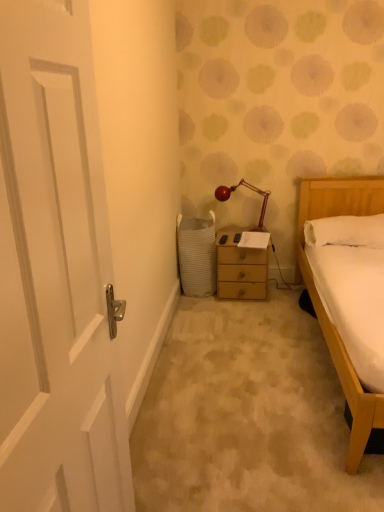
Identify the location of free location to the right of wooden nightstand at center. The width and height of the screenshot is (384, 512). (283, 297).